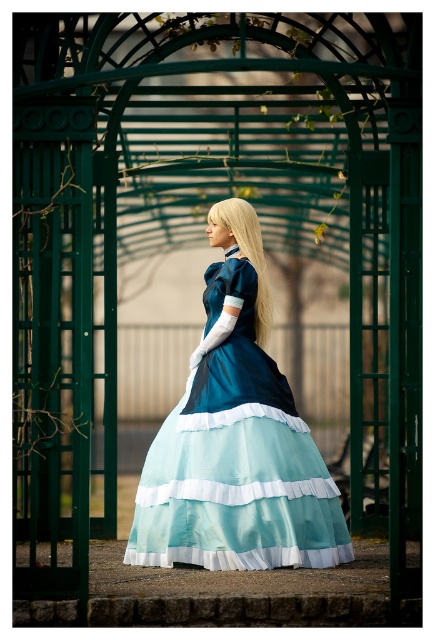
Can you confirm if matte blue dress at center is positioned to the left of blonde silky hair at center?

Yes, matte blue dress at center is to the left of blonde silky hair at center.

Is matte blue dress at center wider than blonde silky hair at center?

Correct, the width of matte blue dress at center exceeds that of blonde silky hair at center.

Which is in front, point (234, 204) or point (271, 307)?

Positioned in front is point (234, 204).

Where is `matte blue dress at center`? This screenshot has width=435, height=640. matte blue dress at center is located at coordinates (236, 438).